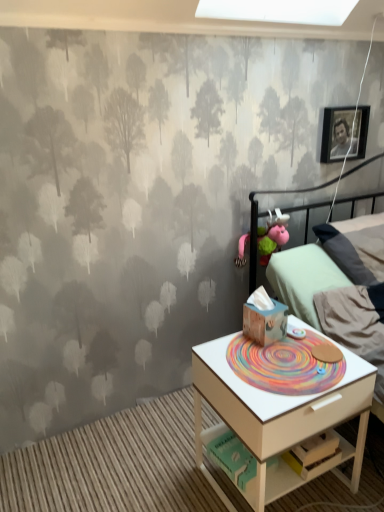
Question: Is the position of light green fabric bed at right more distant than that of white wood nightstand at lower right?

Choices:
 (A) no
 (B) yes

Answer: (B)

Question: From a real-world perspective, is light green fabric bed at right on top of white wood nightstand at lower right?

Choices:
 (A) no
 (B) yes

Answer: (B)

Question: Would you say light green fabric bed at right is outside white wood nightstand at lower right?

Choices:
 (A) yes
 (B) no

Answer: (A)

Question: Considering the relative sizes of light green fabric bed at right and white wood nightstand at lower right in the image provided, is light green fabric bed at right shorter than white wood nightstand at lower right?

Choices:
 (A) no
 (B) yes

Answer: (A)

Question: Is light green fabric bed at right aimed at white wood nightstand at lower right?

Choices:
 (A) yes
 (B) no

Answer: (B)

Question: Considering their positions, is wooden tissue box at center, marked as the 2th toy in a top-to-bottom arrangement, located in front of or behind matte black picture frame at upper right?

Choices:
 (A) behind
 (B) front

Answer: (B)

Question: Is wooden tissue box at center, marked as the 2th toy in a top-to-bottom arrangement, wider or thinner than matte black picture frame at upper right?

Choices:
 (A) thin
 (B) wide

Answer: (B)

Question: Visually, is wooden tissue box at center, placed as the 1th toy when sorted from bottom to top, positioned to the left or to the right of matte black picture frame at upper right?

Choices:
 (A) right
 (B) left

Answer: (B)

Question: Considering the positions of wooden tissue box at center, which is the second toy from back to front, and matte black picture frame at upper right in the image, is wooden tissue box at center, which is the second toy from back to front, taller or shorter than matte black picture frame at upper right?

Choices:
 (A) tall
 (B) short

Answer: (B)

Question: From the image's perspective, is light green fabric bed at right above or below wooden tissue box at center, placed as the 1th toy when sorted from front to back?

Choices:
 (A) above
 (B) below

Answer: (A)

Question: Is point (307, 217) closer or farther from the camera than point (274, 331)?

Choices:
 (A) farther
 (B) closer

Answer: (A)

Question: Relative to wooden tissue box at center, placed as the 1th toy when sorted from bottom to top, is light green fabric bed at right in front or behind?

Choices:
 (A) front
 (B) behind

Answer: (B)

Question: Looking at the image, does light green fabric bed at right seem bigger or smaller compared to wooden tissue box at center, which is the second toy from back to front?

Choices:
 (A) big
 (B) small

Answer: (A)

Question: From a real-world perspective, is matte black picture frame at upper right physically located above or below white wood nightstand at lower right?

Choices:
 (A) above
 (B) below

Answer: (A)

Question: In terms of width, does matte black picture frame at upper right look wider or thinner when compared to white wood nightstand at lower right?

Choices:
 (A) wide
 (B) thin

Answer: (B)